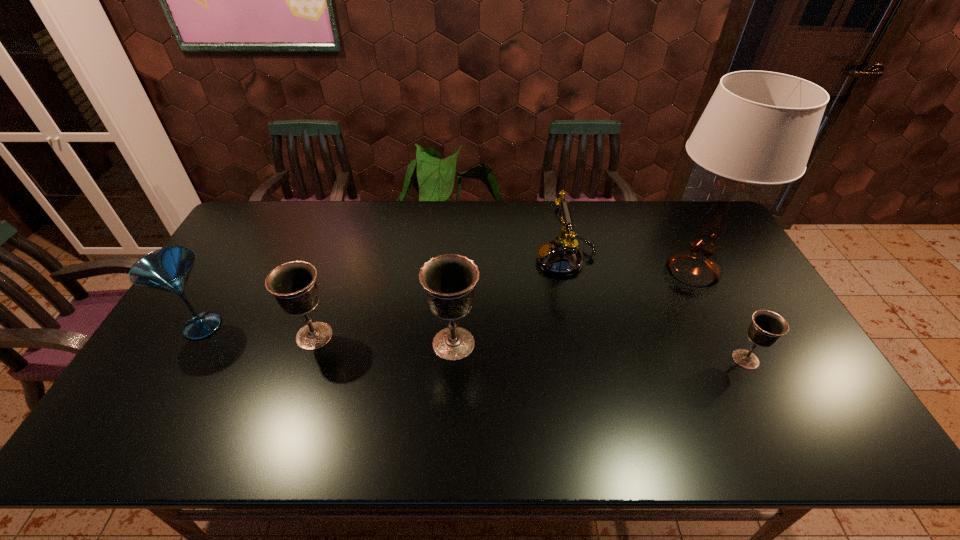
Where is `chalice that is at the right edge`? Image resolution: width=960 pixels, height=540 pixels. chalice that is at the right edge is located at coordinates [766, 328].

Where is `table lamp located in the right edge section of the desktop`? Image resolution: width=960 pixels, height=540 pixels. table lamp located in the right edge section of the desktop is located at coordinates (759, 127).

Find the location of a particular element. Image resolution: width=960 pixels, height=540 pixels. free space at the far edge of the desktop is located at coordinates (444, 234).

Image resolution: width=960 pixels, height=540 pixels. Identify the location of free space at the left edge. (210, 342).

You are a GUI agent. You are given a task and a screenshot of the screen. Output one action in this format:
    pyautogui.click(x=<x>, y=<y>)
    Task: Click on the blank area at the far left corner
    This screenshot has width=960, height=540.
    Given the screenshot: What is the action you would take?
    point(286,219)

Where is `vacant space at the far right corner of the desktop`? The width and height of the screenshot is (960, 540). vacant space at the far right corner of the desktop is located at coordinates (701, 200).

This screenshot has height=540, width=960. In order to click on free point between the shortest object and the leftmost chalice in this screenshot , I will do `click(530, 348)`.

Where is `free space between the fifth object from right to left and the rightmost chalice`? free space between the fifth object from right to left and the rightmost chalice is located at coordinates (530, 348).

What are the coordinates of `free space between the shortest chalice and the third object from right to left` in the screenshot? It's located at (656, 309).

I want to click on free spot between the tallest object and the telephone, so click(x=629, y=265).